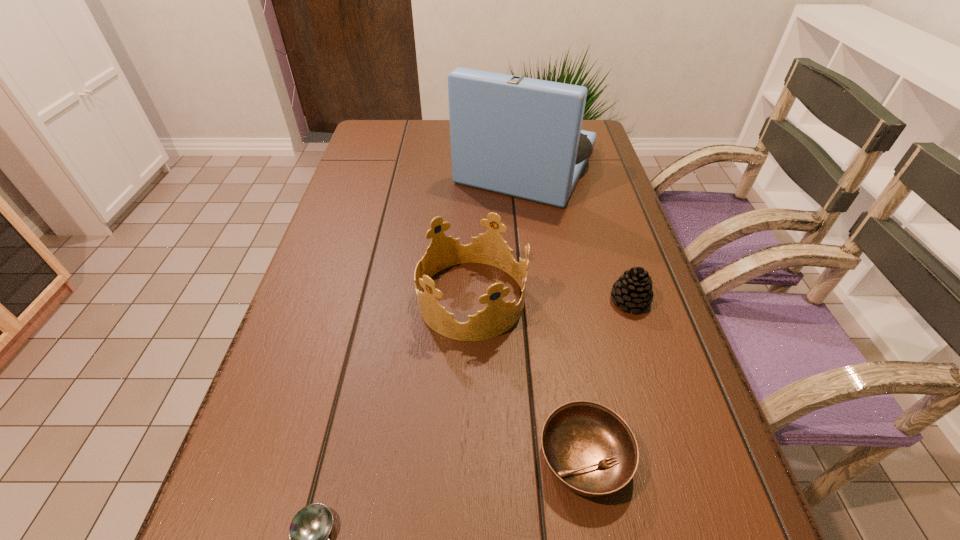
The image size is (960, 540). What are the coordinates of `phonograph record` in the screenshot? It's located at (518, 136).

Find the location of a particular element. the tallest object is located at coordinates (518, 136).

At what (x,y) coordinates should I click in order to perform the action: click on the fourth shortest object. Please return your answer as a coordinate pair (x, y). Image resolution: width=960 pixels, height=540 pixels. Looking at the image, I should click on (489, 248).

The width and height of the screenshot is (960, 540). What are the coordinates of `the third tallest object` in the screenshot? It's located at (633, 289).

I want to click on soup bowl, so click(x=590, y=449).

Locate an element on the screen. The width and height of the screenshot is (960, 540). the fourth farthest object is located at coordinates (590, 449).

Locate an element on the screen. free space located on the front of the tallest object is located at coordinates (535, 222).

This screenshot has height=540, width=960. What are the coordinates of `blank space located on the front-facing side of the tiara` in the screenshot? It's located at (558, 299).

At what (x,y) coordinates should I click in order to perform the action: click on vacant space located 0.130m at the narrow end of the third tallest object. Please return your answer as a coordinate pair (x, y). The height and width of the screenshot is (540, 960). Looking at the image, I should click on pos(653,372).

In order to click on vacant area located on the back of the fourth tallest object in this screenshot , I will do `click(555, 282)`.